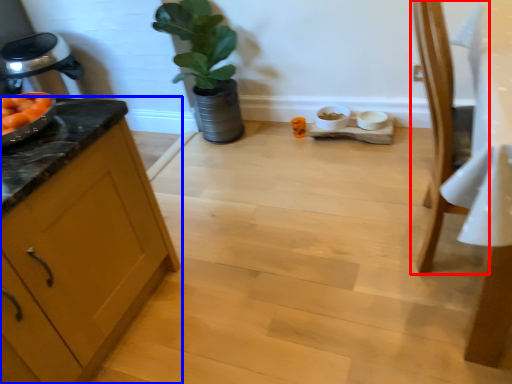
Question: Which point is closer to the camera, chair (highlighted by a red box) or cabinetry (highlighted by a blue box)?

Choices:
 (A) chair
 (B) cabinetry

Answer: (B)